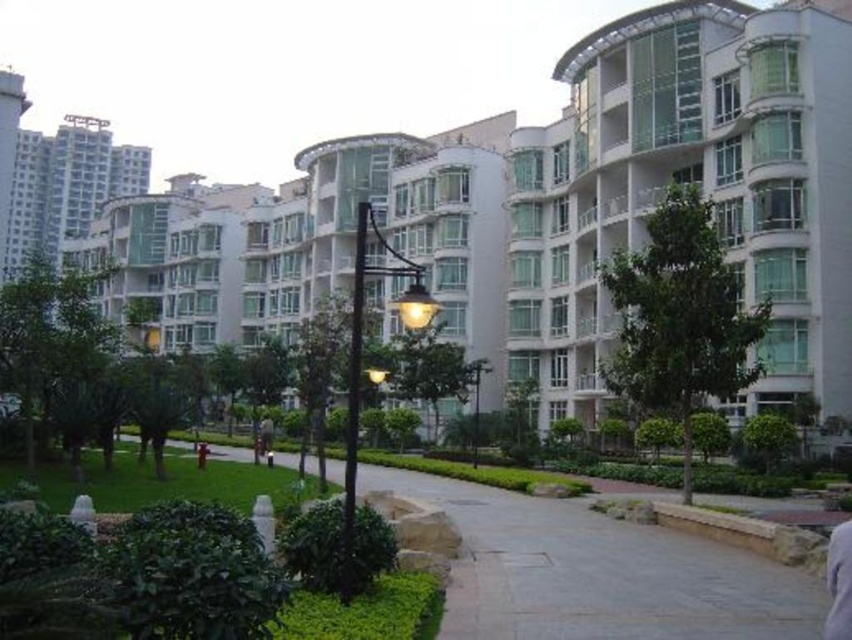
Does white glass condominium at upper center have a smaller size compared to smooth concrete path at center?

No, white glass condominium at upper center is not smaller than smooth concrete path at center.

The width and height of the screenshot is (852, 640). What do you see at coordinates (692, 182) in the screenshot? I see `white glass condominium at upper center` at bounding box center [692, 182].

Describe the element at coordinates (692, 182) in the screenshot. I see `white glass condominium at upper center` at that location.

The width and height of the screenshot is (852, 640). I want to click on white glass condominium at upper center, so click(692, 182).

Which is in front, point (148, 259) or point (258, 449)?

Point (258, 449)

Can you confirm if white glossy building at center is positioned to the left of dark blue jeans at center?

Indeed, white glossy building at center is positioned on the left side of dark blue jeans at center.

Who is more forward, (807, 339) or (268, 440)?

Point (807, 339) is more forward.

What are the coordinates of `white glossy building at center` in the screenshot? It's located at (559, 208).

Which is above, white glossy building at center or gray fabric shirt at lower right?

white glossy building at center

From the picture: Between white glossy building at center and gray fabric shirt at lower right, which one appears on the left side from the viewer's perspective?

From the viewer's perspective, white glossy building at center appears more on the left side.

This screenshot has width=852, height=640. Identify the location of white glossy building at center. (559, 208).

Find the location of `white glossy building at center`. white glossy building at center is located at coordinates (559, 208).